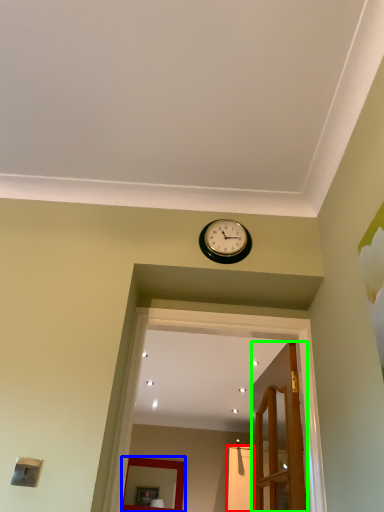
Question: Which object is the farthest from glass door (highlighted by a red box)? Choose among these: mirror (highlighted by a blue box) or door (highlighted by a green box).

Choices:
 (A) mirror
 (B) door

Answer: (B)